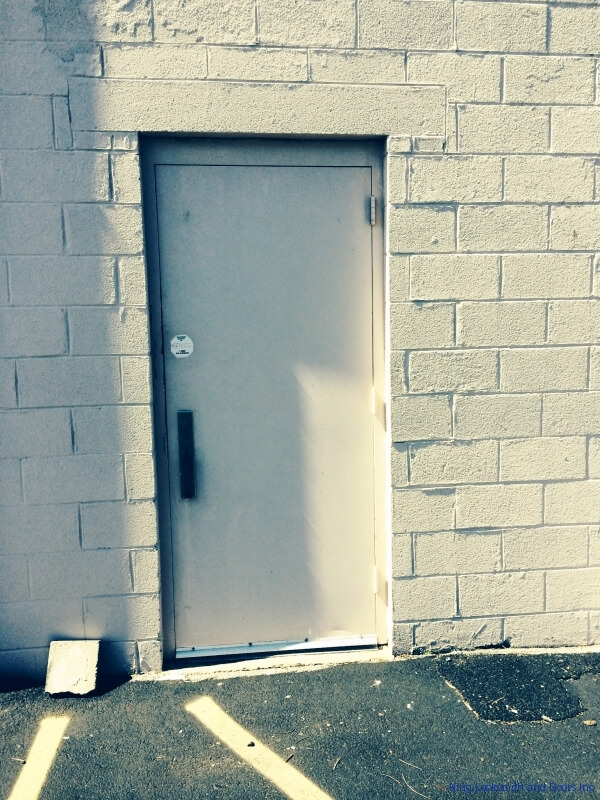
At what (x,y) coordinates should I click in order to perform the action: click on weatherstripping. Please return your answer as a coordinate pair (x, y). This screenshot has width=600, height=800. Looking at the image, I should click on (278, 646).